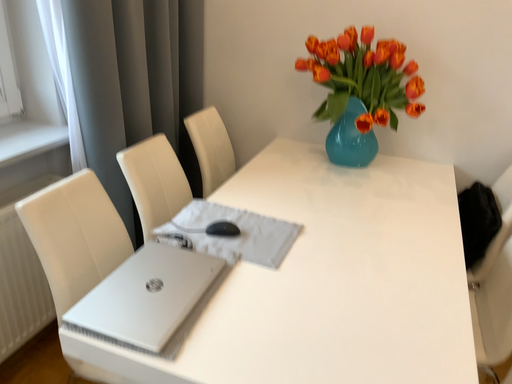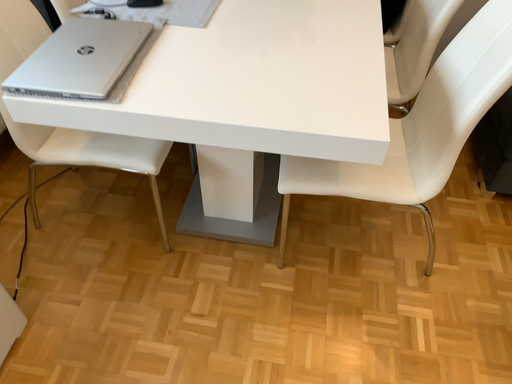
Question: Which way did the camera rotate in the video?

Choices:
 (A) rotated downward
 (B) rotated upward

Answer: (A)